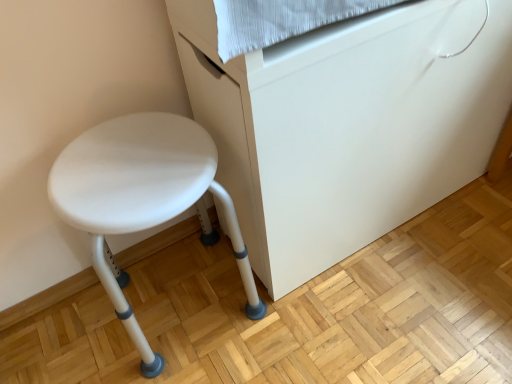
This screenshot has height=384, width=512. Find the location of `free space in front of white plastic stool at lower left`. free space in front of white plastic stool at lower left is located at coordinates (404, 296).